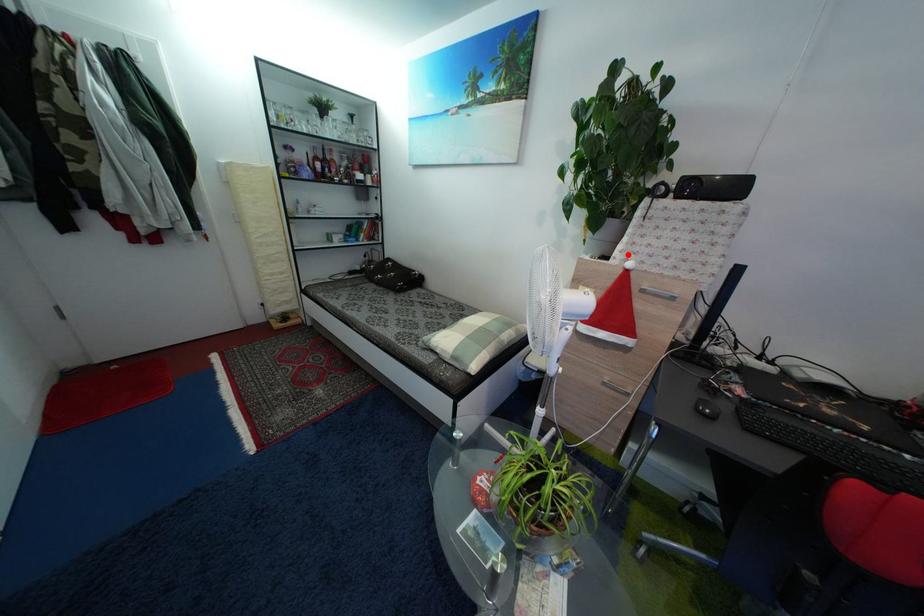
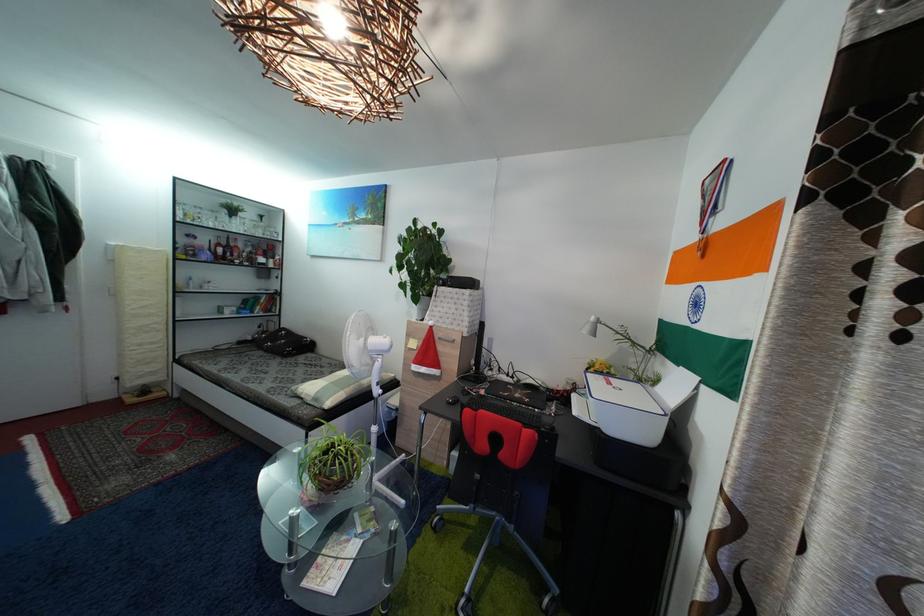
Find the pixel in the second image that matches the highlighted location in the first image.

(435, 321)